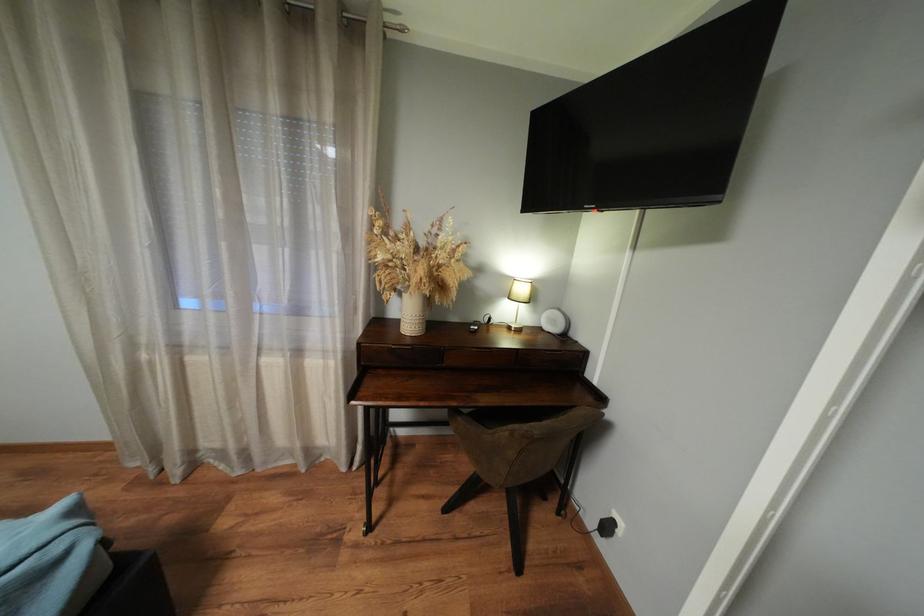
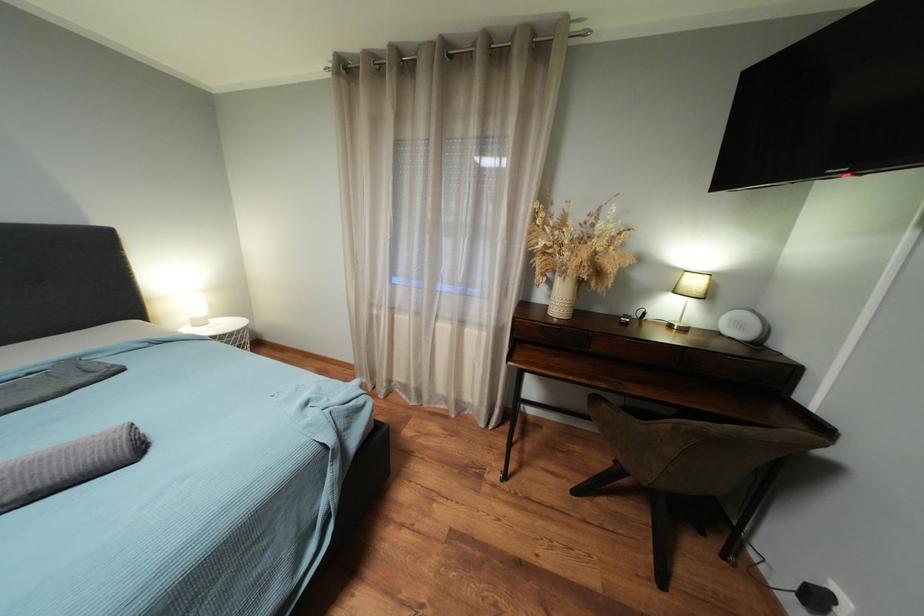
Which direction would the cameraman need to move to produce the second image?

The movement direction of the cameraman is left, backward.